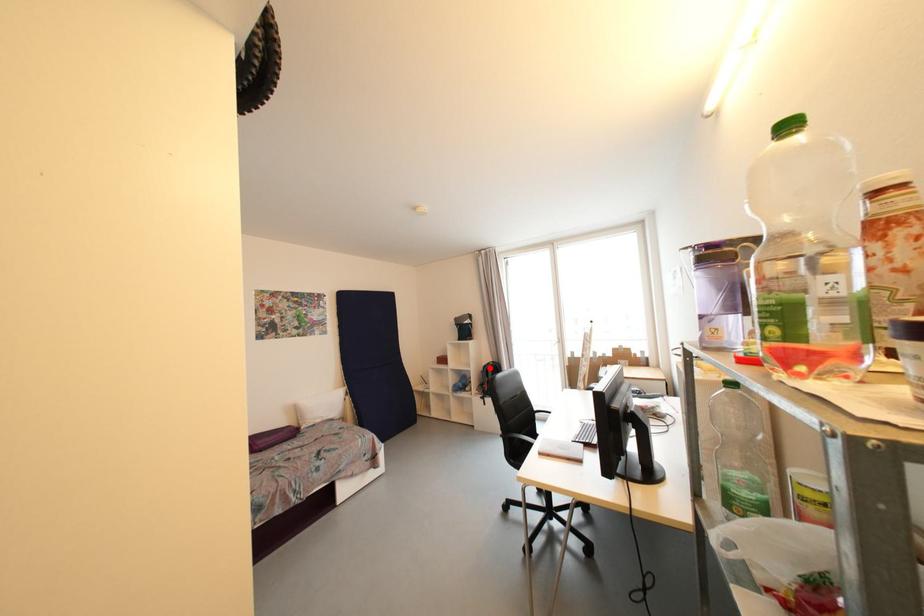
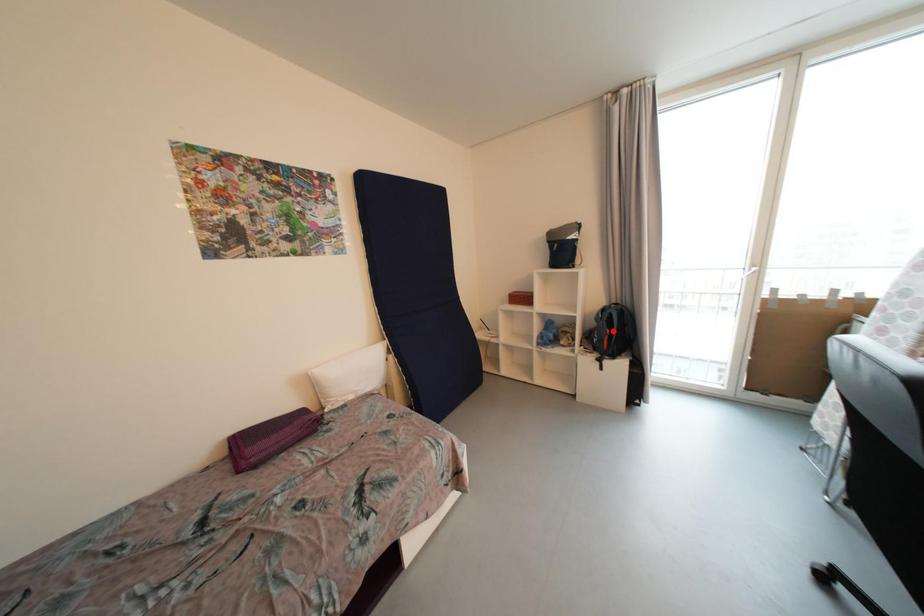
I am providing you with two images of the same scene from different viewpoints. A red point is marked on the first image and another point is marked on the second image. Do the highlighted points in image1 and image2 indicate the same real-world spot?

No